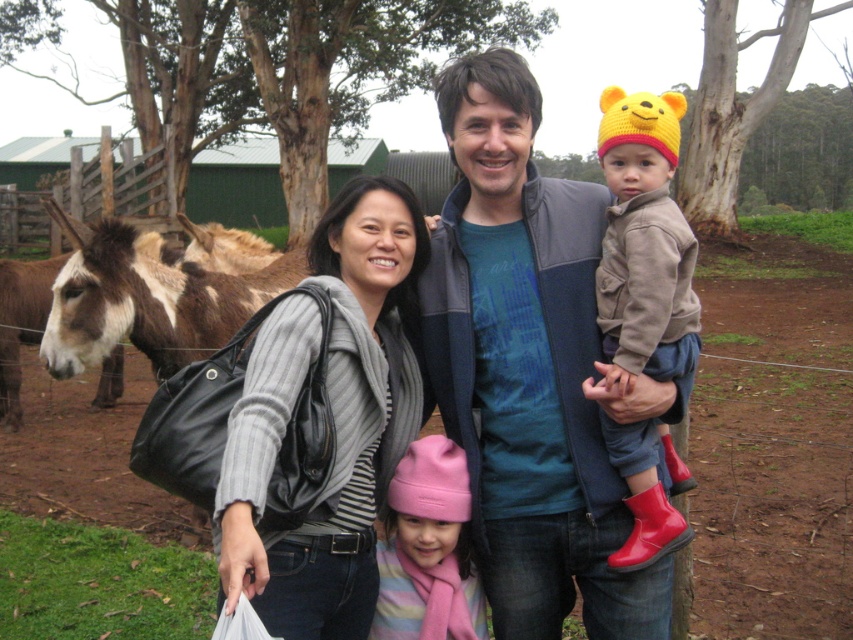
Question: Considering the real-world distances, which object is farthest from the blue fleece jacket at center?

Choices:
 (A) pink fleece hat at center
 (B) gray woolen sweater at center

Answer: (B)

Question: Does blue fleece jacket at center appear over brown fuzzy donkey at left?

Choices:
 (A) yes
 (B) no

Answer: (B)

Question: Is blue fleece jacket at center to the right of knitted wool hat at upper right from the viewer's perspective?

Choices:
 (A) yes
 (B) no

Answer: (B)

Question: Which of the following is the farthest from the observer?

Choices:
 (A) brown fuzzy donkey at left
 (B) pink fleece hat at center
 (C) knitted wool hat at upper right

Answer: (A)

Question: Can you confirm if blue fleece jacket at center is bigger than gray woolen sweater at center?

Choices:
 (A) yes
 (B) no

Answer: (A)

Question: Which object appears farthest from the camera in this image?

Choices:
 (A) pink fleece hat at center
 (B) gray woolen sweater at center

Answer: (A)